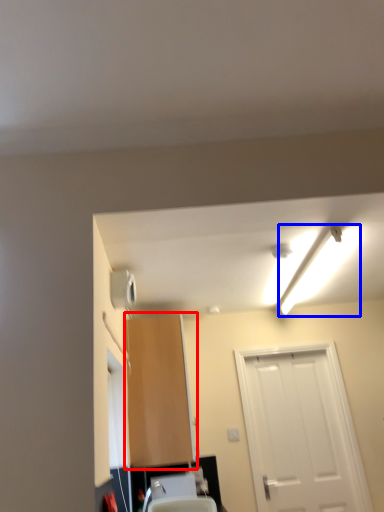
Question: Which point is closer to the camera, cabinetry (highlighted by a red box) or light fixture (highlighted by a blue box)?

Choices:
 (A) cabinetry
 (B) light fixture

Answer: (B)